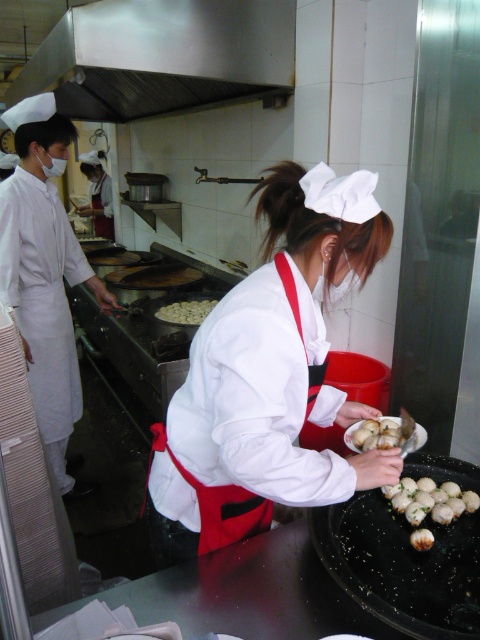
Between point (396, 435) and point (197, 305), which one is positioned in front?

Positioned in front is point (396, 435).

Does white glossy mushrooms at center have a larger size compared to white matte dumplings at center?

Incorrect, white glossy mushrooms at center is not larger than white matte dumplings at center.

Between point (403, 436) and point (170, 308), which one is positioned in front?

Positioned in front is point (403, 436).

Locate an element on the screen. The height and width of the screenshot is (640, 480). white glossy mushrooms at center is located at coordinates (384, 435).

Between white matte apron at center and stainless steel exhaust hood at upper center, which one is positioned higher?

stainless steel exhaust hood at upper center

Between point (203, 413) and point (127, 8), which one is positioned in front?

Point (203, 413) is more forward.

Where is `white matte apron at center`? The width and height of the screenshot is (480, 640). white matte apron at center is located at coordinates (x=269, y=374).

Is stainless steel exhaust hood at upper center taller than white glossy mushrooms at center?

Indeed, stainless steel exhaust hood at upper center has a greater height compared to white glossy mushrooms at center.

Does stainless steel exhaust hood at upper center come in front of white glossy mushrooms at center?

No, stainless steel exhaust hood at upper center is further to the viewer.

Describe the element at coordinates (160, 56) in the screenshot. The width and height of the screenshot is (480, 640). I see `stainless steel exhaust hood at upper center` at that location.

The image size is (480, 640). I want to click on stainless steel exhaust hood at upper center, so click(160, 56).